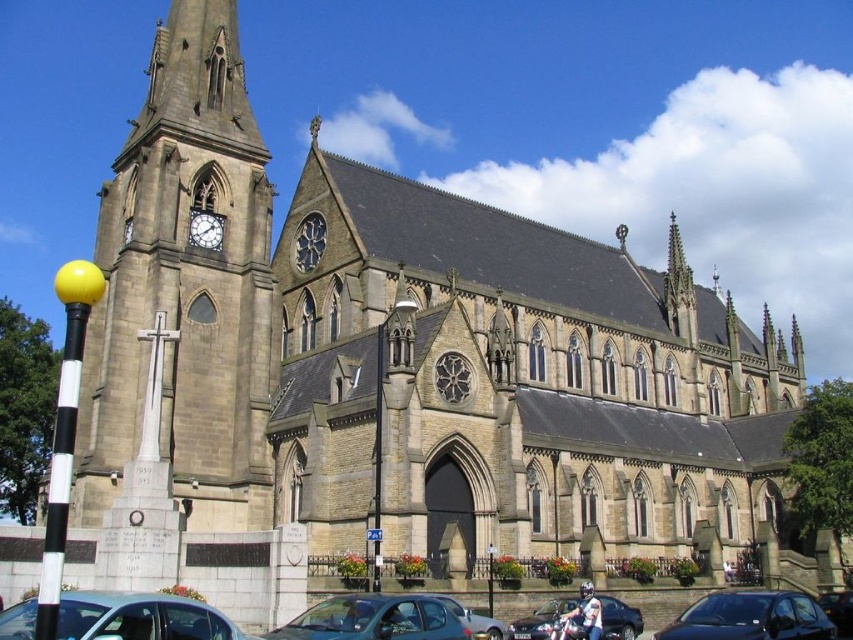
Question: Is stone clock tower at left to the right of metallic blue hatchback at lower center from the viewer's perspective?

Choices:
 (A) yes
 (B) no

Answer: (B)

Question: Which object appears closest to the camera in this image?

Choices:
 (A) shiny black car at center
 (B) white clock face at upper left

Answer: (A)

Question: Can you confirm if stone clock tower at left is wider than white clock face at upper left?

Choices:
 (A) no
 (B) yes

Answer: (B)

Question: Which object is positioned farthest from the white clock face at upper left?

Choices:
 (A) shiny black car at lower right
 (B) metallic blue hatchback at lower center
 (C) metallic silver car at lower center
 (D) shiny black car at center

Answer: (D)

Question: Does stone clock tower at left have a greater width compared to metallic blue hatchback at lower center?

Choices:
 (A) yes
 (B) no

Answer: (A)

Question: Among these points, which one is farthest from the camera?

Choices:
 (A) (270, 449)
 (B) (321, 630)
 (C) (757, 621)
 (D) (834, 608)

Answer: (A)